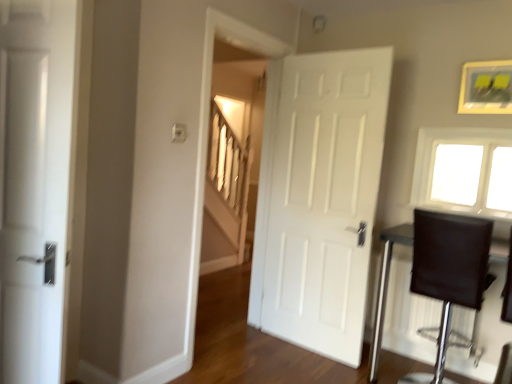
Question: Would you say gold-framed picture at upper right is part of white matte door at left, which is the first door in front-to-back order,'s contents?

Choices:
 (A) yes
 (B) no

Answer: (B)

Question: Considering the relative sizes of white matte door at left, which is counted as the second door, starting from the right, and gold-framed picture at upper right in the image provided, is white matte door at left, which is counted as the second door, starting from the right, wider than gold-framed picture at upper right?

Choices:
 (A) no
 (B) yes

Answer: (B)

Question: From the image's perspective, is white matte door at left, which is the first door in front-to-back order, under gold-framed picture at upper right?

Choices:
 (A) no
 (B) yes

Answer: (B)

Question: Does white matte door at left, which is counted as the 1th door, starting from the left, appear on the right side of gold-framed picture at upper right?

Choices:
 (A) no
 (B) yes

Answer: (A)

Question: Does white matte door at left, which is counted as the second door, starting from the right, come in front of gold-framed picture at upper right?

Choices:
 (A) no
 (B) yes

Answer: (B)

Question: Based on their sizes in the image, would you say dark brown leather table at right is bigger or smaller than white matte door at center, which appears as the second door when viewed from the front?

Choices:
 (A) small
 (B) big

Answer: (B)

Question: Is point (377, 324) closer or farther from the camera than point (266, 150)?

Choices:
 (A) farther
 (B) closer

Answer: (B)

Question: Is dark brown leather table at right situated inside white matte door at center, the first door viewed from the back, or outside?

Choices:
 (A) inside
 (B) outside

Answer: (B)

Question: Is dark brown leather table at right taller or shorter than white matte door at center, the first door viewed from the back?

Choices:
 (A) short
 (B) tall

Answer: (A)

Question: Visually, is gold-framed picture at upper right positioned to the left or to the right of dark brown leather table at right?

Choices:
 (A) right
 (B) left

Answer: (A)

Question: Looking at their shapes, would you say gold-framed picture at upper right is wider or thinner than dark brown leather table at right?

Choices:
 (A) thin
 (B) wide

Answer: (A)

Question: Considering the positions of point (x=471, y=64) and point (x=384, y=249), is point (x=471, y=64) closer or farther from the camera than point (x=384, y=249)?

Choices:
 (A) farther
 (B) closer

Answer: (B)

Question: From a real-world perspective, is gold-framed picture at upper right physically located above or below dark brown leather table at right?

Choices:
 (A) below
 (B) above

Answer: (B)

Question: From a real-world perspective, is white matte door at center, which is the 2th door in left-to-right order, physically located above or below gold-framed picture at upper right?

Choices:
 (A) above
 (B) below

Answer: (B)

Question: Is point (326, 183) closer or farther from the camera than point (481, 96)?

Choices:
 (A) closer
 (B) farther

Answer: (B)